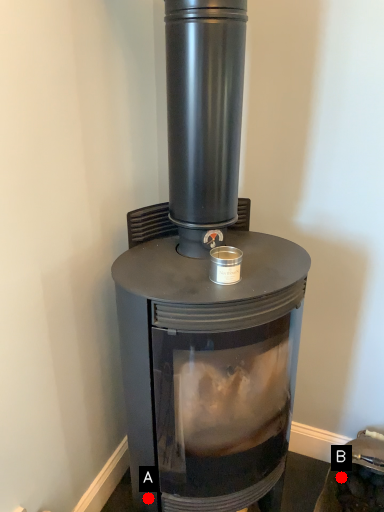
Question: Two points are circled on the image, labeled by A and B beside each circle. Which point is further to the camera?

Choices:
 (A) A is further
 (B) B is further

Answer: (B)